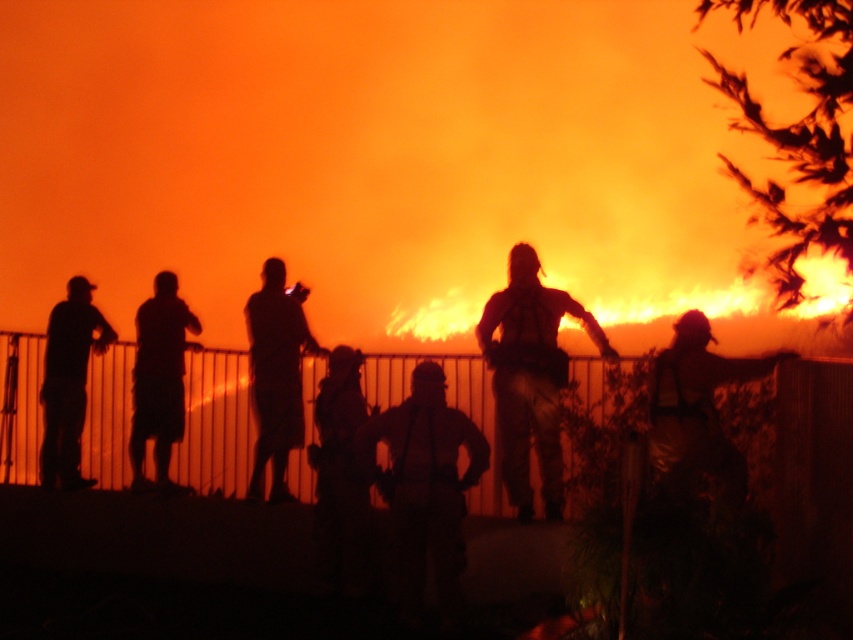
Question: Can you confirm if dark matte shorts at left is positioned to the right of silhouette uniform at center?

Choices:
 (A) no
 (B) yes

Answer: (A)

Question: Among these points, which one is nearest to the camera?

Choices:
 (A) (61, 456)
 (B) (357, 413)
 (C) (277, 362)
 (D) (512, 308)

Answer: (D)

Question: Does dark brown leather jacket at center appear on the left side of metallic gold helmet at center?

Choices:
 (A) no
 (B) yes

Answer: (B)

Question: Which point appears farthest from the camera in this image?

Choices:
 (A) (326, 378)
 (B) (160, 385)
 (C) (544, 298)

Answer: (B)

Question: Estimate the real-world distances between objects in this image. Which object is farther from the dark matte shorts at left?

Choices:
 (A) dark brown uniform at center
 (B) matte black shirt at left
 (C) dark brown leather jacket at center

Answer: (C)

Question: Does silhouette figure at center lie behind matte black shirt at left?

Choices:
 (A) no
 (B) yes

Answer: (A)